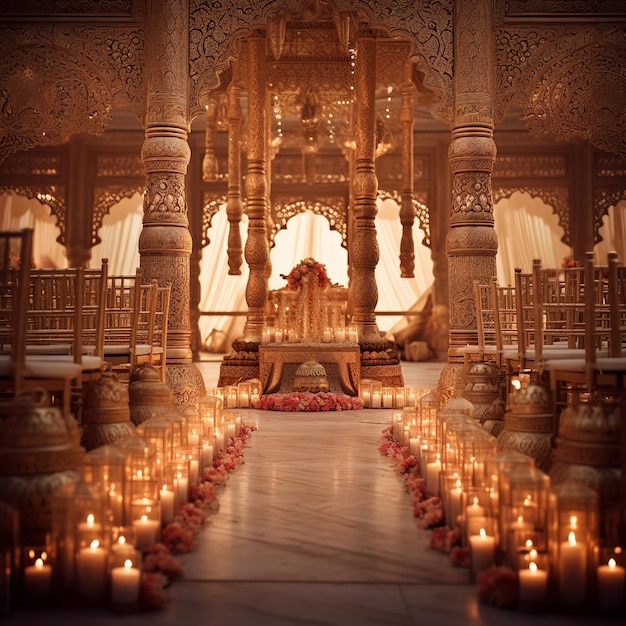
The width and height of the screenshot is (626, 626). In order to click on windows in this screenshot , I will do `click(300, 198)`, `click(290, 235)`.